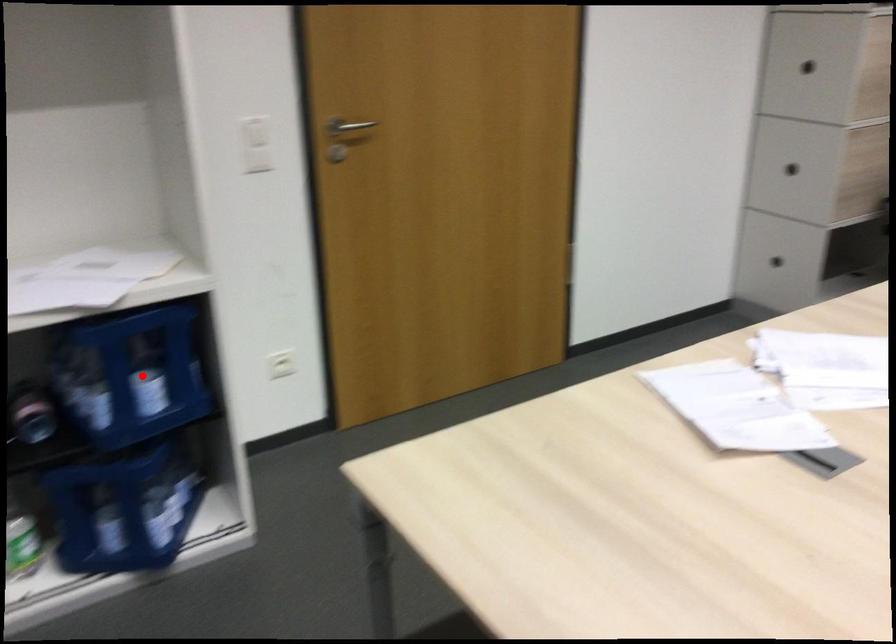
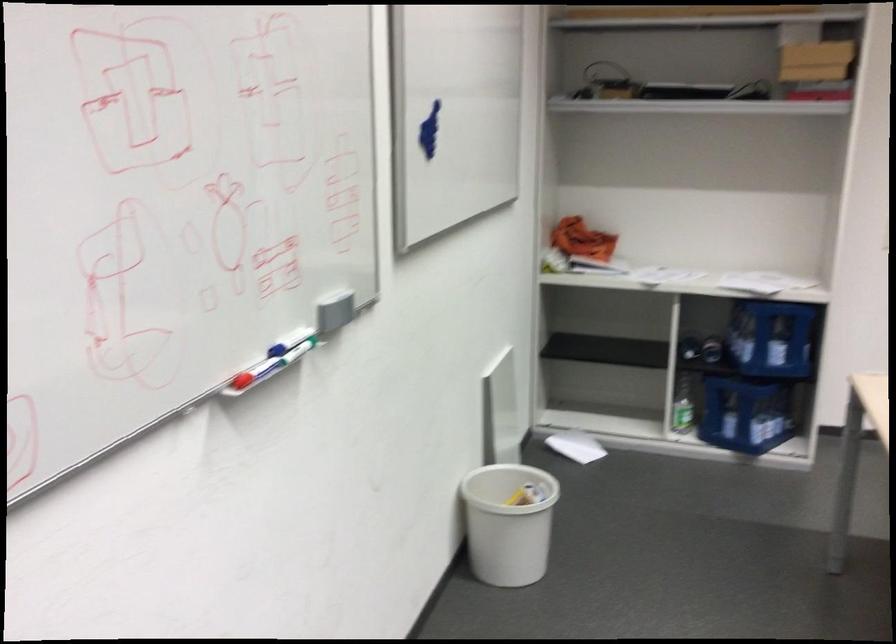
Question: I am providing you with two images of the same scene from different viewpoints. In image1, a red point is highlighted. Considering the same 3D point in image2, which of the following is correct?

Choices:
 (A) It is closer
 (B) It is farther

Answer: (B)